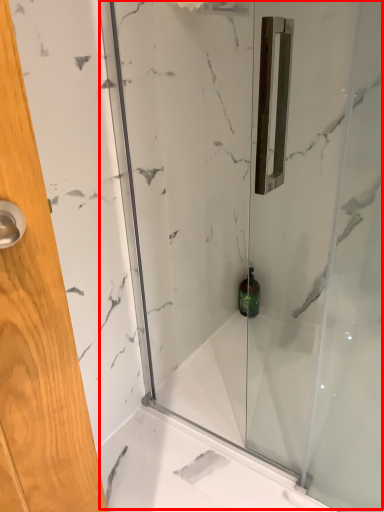
Question: From the image, what is the correct spatial relationship of shower door (annotated by the red box) in relation to toiletry?

Choices:
 (A) right
 (B) left

Answer: (B)